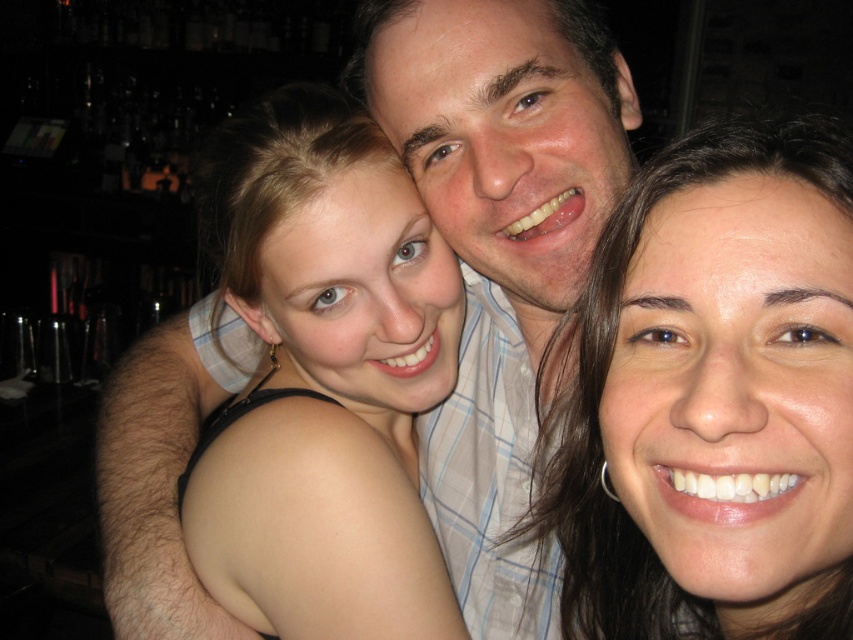
Is white plaid shirt at center bigger than smooth skin shoulder at center?

Correct, white plaid shirt at center is larger in size than smooth skin shoulder at center.

Where is `white plaid shirt at center`? white plaid shirt at center is located at coordinates (500, 243).

Where is `white plaid shirt at center`? This screenshot has height=640, width=853. white plaid shirt at center is located at coordinates (500, 243).

Is smooth skin face at center further to camera compared to white plaid shirt at center?

No, it is not.

Can you confirm if smooth skin face at center is wider than white plaid shirt at center?

Incorrect, smooth skin face at center's width does not surpass white plaid shirt at center's.

Where is `smooth skin face at center`? smooth skin face at center is located at coordinates (714, 397).

Which is more to the right, smooth skin face at center or smooth skin shoulder at center?

smooth skin face at center is more to the right.

Is smooth skin face at center smaller than smooth skin shoulder at center?

Indeed, smooth skin face at center has a smaller size compared to smooth skin shoulder at center.

Who is more distant from viewer, (619,577) or (242,534)?

The point (242,534) is more distant.

What are the coordinates of `smooth skin face at center` in the screenshot? It's located at (714, 397).